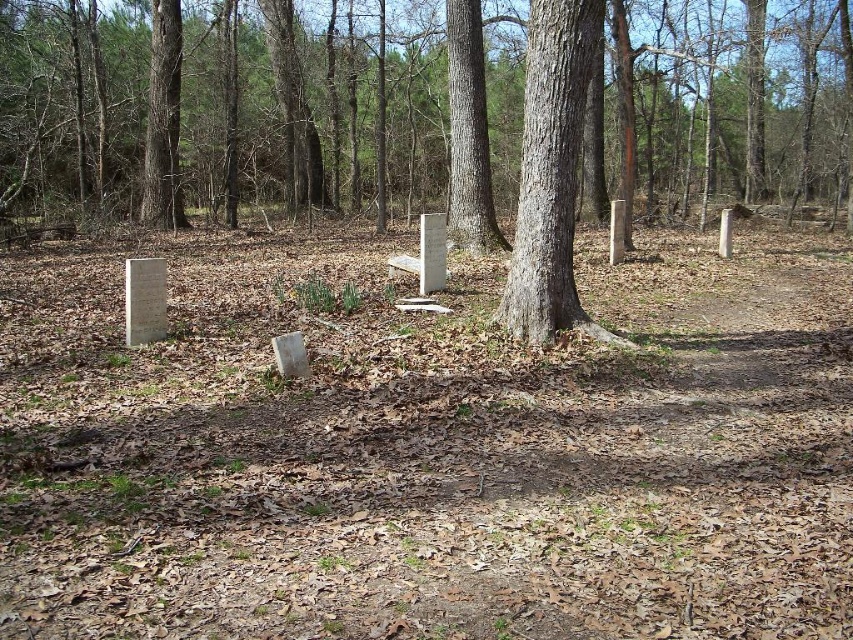
Which is in front, point (463, 81) or point (157, 97)?

Positioned in front is point (463, 81).

How far apart are brown rough bark tree at center and smooth bark tree at center?

brown rough bark tree at center is 10.34 meters from smooth bark tree at center.

What do you see at coordinates (468, 132) in the screenshot? I see `brown rough bark tree at center` at bounding box center [468, 132].

The image size is (853, 640). In order to click on brown rough bark tree at center in this screenshot , I will do `click(468, 132)`.

What do you see at coordinates (259, 112) in the screenshot?
I see `smooth concrete markers at center` at bounding box center [259, 112].

Who is more forward, (x=653, y=128) or (x=148, y=221)?

Point (x=148, y=221) is more forward.

The image size is (853, 640). I want to click on smooth concrete markers at center, so click(259, 112).

Is point (524, 120) in front of point (453, 237)?

Yes, it is in front of point (453, 237).

Does smooth gray tree trunk at center have a smaller size compared to brown rough bark tree at center?

No.

Is point (581, 104) less distant than point (456, 182)?

Yes, point (581, 104) is closer to viewer.

Where is `smooth gray tree trunk at center`? smooth gray tree trunk at center is located at coordinates (550, 173).